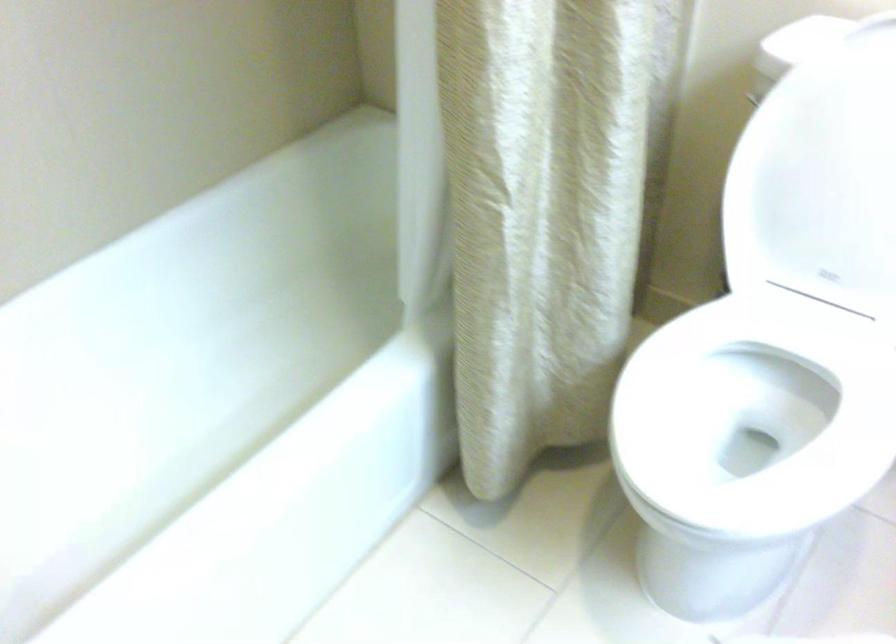
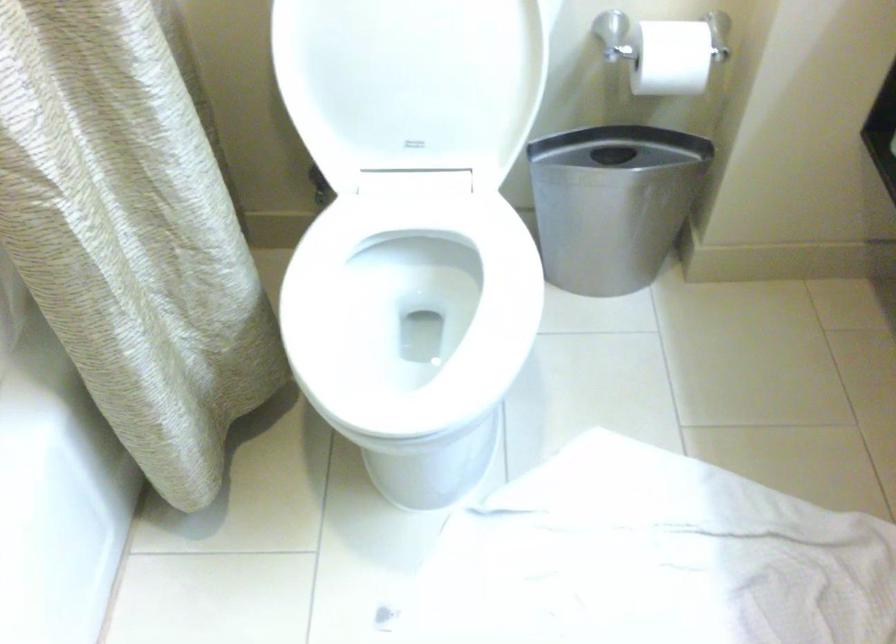
Question: The camera is either moving clockwise (left) or counter-clockwise (right) around the object. The first image is from the beginning of the video and the second image is from the end. Is the camera moving left or right when shooting the video?

Choices:
 (A) Left
 (B) Right

Answer: (A)